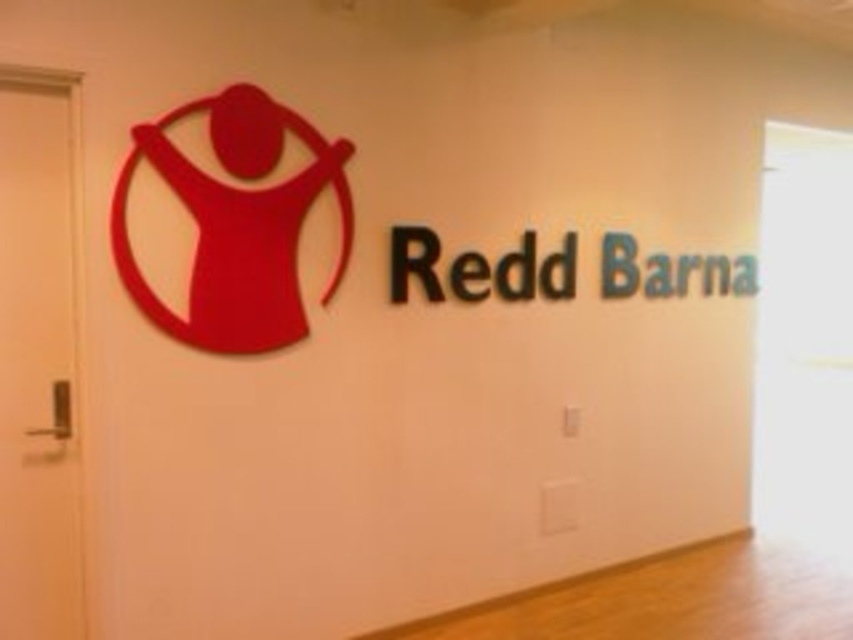
Question: Does black matte sign at upper center lie in front of green matte barna at upper right?

Choices:
 (A) yes
 (B) no

Answer: (A)

Question: Can you confirm if matte red logo at upper left is thinner than black matte sign at upper center?

Choices:
 (A) yes
 (B) no

Answer: (A)

Question: Among these objects, which one is nearest to the camera?

Choices:
 (A) black matte sign at upper center
 (B) matte red logo at upper left
 (C) green matte barna at upper right

Answer: (B)

Question: Among these objects, which one is nearest to the camera?

Choices:
 (A) black matte sign at upper center
 (B) matte red logo at upper left

Answer: (B)

Question: Considering the relative positions of matte red logo at upper left and black matte sign at upper center in the image provided, where is matte red logo at upper left located with respect to black matte sign at upper center?

Choices:
 (A) below
 (B) above

Answer: (B)

Question: Which of these objects is positioned closest to the black matte sign at upper center?

Choices:
 (A) green matte barna at upper right
 (B) matte red logo at upper left

Answer: (B)